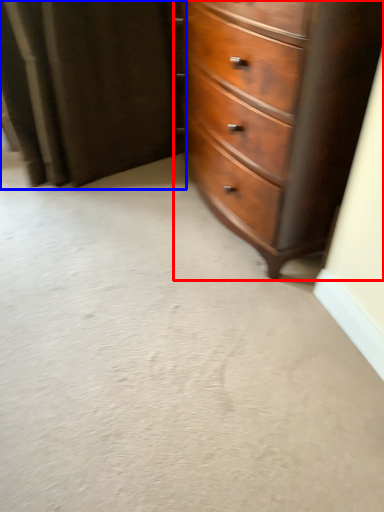
Question: Which object appears farthest to the camera in this image, chest of drawers (highlighted by a red box) or curtain (highlighted by a blue box)?

Choices:
 (A) chest of drawers
 (B) curtain

Answer: (B)